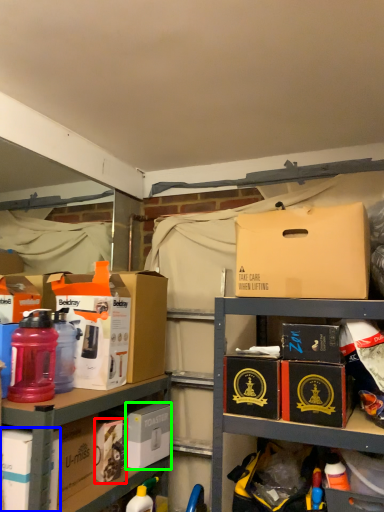
Question: Considering the real-world distances, which object is farthest from kit (highlighted by a red box)? box (highlighted by a blue box) or box (highlighted by a green box)?

Choices:
 (A) box
 (B) box

Answer: (A)